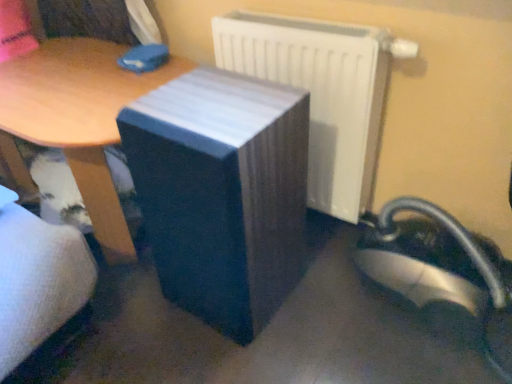
Question: From a real-world perspective, does wooden table at center, arranged as the 1th table when viewed from the left, sit lower than white glossy radiator at upper right?

Choices:
 (A) no
 (B) yes

Answer: (B)

Question: Is wooden table at center, arranged as the 1th table when viewed from the left, at the right side of white glossy radiator at upper right?

Choices:
 (A) yes
 (B) no

Answer: (B)

Question: Is white glossy radiator at upper right located within wooden table at center, arranged as the 1th table when viewed from the left?

Choices:
 (A) yes
 (B) no

Answer: (B)

Question: Can you confirm if wooden table at center, arranged as the 1th table when viewed from the left, is thinner than white glossy radiator at upper right?

Choices:
 (A) no
 (B) yes

Answer: (A)

Question: Is wooden table at center, arranged as the 1th table when viewed from the left, at the left side of white glossy radiator at upper right?

Choices:
 (A) no
 (B) yes

Answer: (B)

Question: Is matte black speaker at center, which is counted as the 1th table, starting from the right, taller or shorter than white glossy radiator at upper right?

Choices:
 (A) tall
 (B) short

Answer: (A)

Question: From a real-world perspective, is matte black speaker at center, which is the second table from left to right, above or below white glossy radiator at upper right?

Choices:
 (A) below
 (B) above

Answer: (A)

Question: Based on their sizes in the image, would you say matte black speaker at center, which is counted as the 1th table, starting from the right, is bigger or smaller than white glossy radiator at upper right?

Choices:
 (A) big
 (B) small

Answer: (A)

Question: Considering the relative positions of matte black speaker at center, which is the second table from left to right, and white glossy radiator at upper right in the image provided, is matte black speaker at center, which is the second table from left to right, to the left or to the right of white glossy radiator at upper right?

Choices:
 (A) left
 (B) right

Answer: (A)

Question: Is white glossy radiator at upper right inside or outside of wooden table at center, acting as the second table starting from the right?

Choices:
 (A) outside
 (B) inside

Answer: (A)

Question: Considering the positions of white glossy radiator at upper right and wooden table at center, arranged as the 1th table when viewed from the left, in the image, is white glossy radiator at upper right taller or shorter than wooden table at center, arranged as the 1th table when viewed from the left,?

Choices:
 (A) short
 (B) tall

Answer: (B)

Question: Considering the positions of white glossy radiator at upper right and wooden table at center, acting as the second table starting from the right, in the image, is white glossy radiator at upper right wider or thinner than wooden table at center, acting as the second table starting from the right,?

Choices:
 (A) wide
 (B) thin

Answer: (B)

Question: Is white glossy radiator at upper right bigger or smaller than wooden table at center, acting as the second table starting from the right?

Choices:
 (A) small
 (B) big

Answer: (A)

Question: Is white glossy radiator at upper right inside the boundaries of matte black speaker at center, which is counted as the 1th table, starting from the right, or outside?

Choices:
 (A) inside
 (B) outside

Answer: (B)

Question: From their relative heights in the image, would you say white glossy radiator at upper right is taller or shorter than matte black speaker at center, which is counted as the 1th table, starting from the right?

Choices:
 (A) tall
 (B) short

Answer: (B)